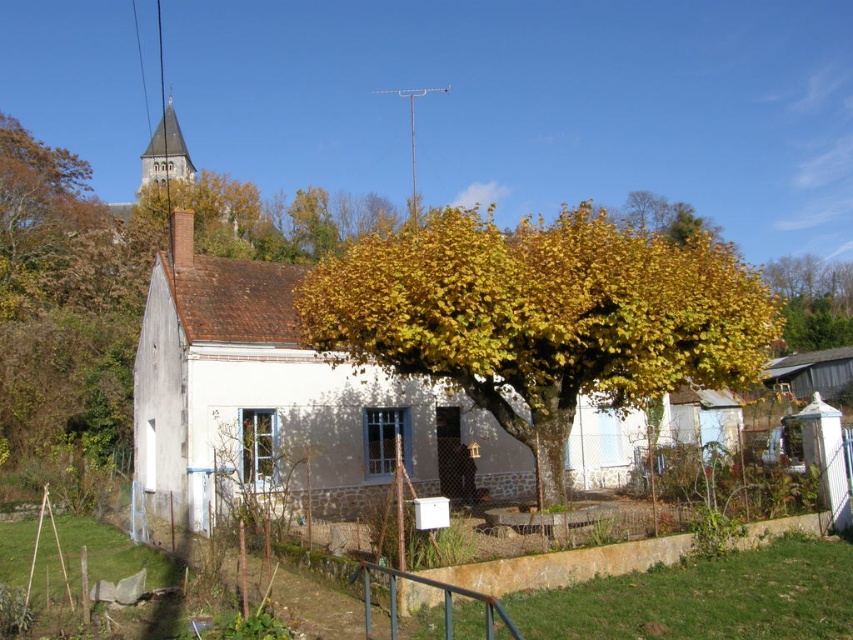
Is the position of golden leafy tree at center more distant than that of yellow leafy tree at upper right?

No, golden leafy tree at center is in front of yellow leafy tree at upper right.

Is golden leafy tree at center shorter than yellow leafy tree at upper right?

Incorrect, golden leafy tree at center's height does not fall short of yellow leafy tree at upper right's.

Identify the location of golden leafy tree at center. The image size is (853, 640). (543, 317).

This screenshot has width=853, height=640. In order to click on golden leafy tree at center in this screenshot , I will do `click(543, 317)`.

At what (x,y) coordinates should I click in order to perform the action: click on white stone cottage at center. Please return your answer as a coordinate pair (x, y). This screenshot has width=853, height=640. Looking at the image, I should click on pyautogui.click(x=281, y=404).

Who is more distant from viewer, (170, 440) or (798, 396)?

The point (798, 396) is behind.

Which is behind, point (451, 410) or point (834, 378)?

The point (834, 378) is more distant.

Find the location of a particular element. The height and width of the screenshot is (640, 853). white stone cottage at center is located at coordinates (281, 404).

Is yellow leafy tree at upper right shorter than brown wooden cottage at center-right?

Incorrect, yellow leafy tree at upper right's height does not fall short of brown wooden cottage at center-right's.

Which is more to the right, yellow leafy tree at upper right or brown wooden cottage at center-right?

From the viewer's perspective, yellow leafy tree at upper right appears more on the right side.

Between point (817, 276) and point (782, 365), which one is positioned behind?

Point (817, 276)

Identify the location of yellow leafy tree at upper right. This screenshot has height=640, width=853. (813, 300).